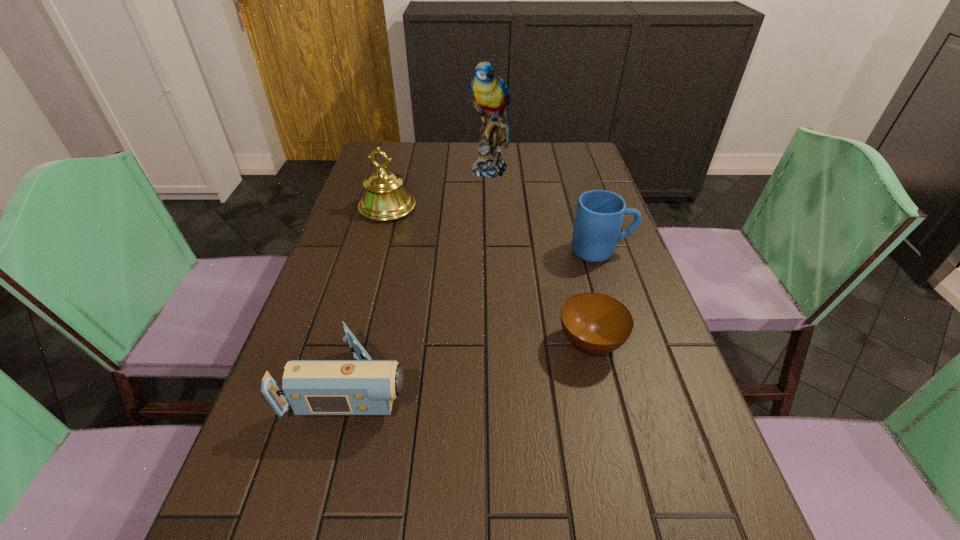
The image size is (960, 540). Find the location of `free space between the shortest object and the camcorder`. free space between the shortest object and the camcorder is located at coordinates (472, 363).

At what (x,y) coordinates should I click in order to perform the action: click on empty space that is in between the mug and the third object from left to right. Please return your answer as a coordinate pair (x, y). Looking at the image, I should click on (545, 210).

Where is `empty space between the fourth shortest object and the shortest object`? empty space between the fourth shortest object and the shortest object is located at coordinates (489, 275).

What are the coordinates of `free space between the bell and the camcorder` in the screenshot? It's located at (371, 295).

Find the location of `vacant space that's between the second tallest object and the fourth tallest object`. vacant space that's between the second tallest object and the fourth tallest object is located at coordinates (371, 295).

Identify which object is the nearest to the bowl. Please provide its 2D coordinates. Your answer should be formatted as a tuple, i.e. [(x, y)], where the tuple contains the x and y coordinates of a point satisfying the conditions above.

[(599, 216)]

Find the location of `object that stands as the third closest to the bell`. object that stands as the third closest to the bell is located at coordinates (364, 387).

At what (x,y) coordinates should I click in order to perform the action: click on vacant space that satisfies the following two spatial constraints: 1. on the face of the third object from right to left; 2. on the side of the fourth tallest object with the flip-out screen. Please return your answer as a coordinate pair (x, y). Looking at the image, I should click on (496, 383).

At what (x,y) coordinates should I click in order to perform the action: click on blank area in the image that satisfies the following two spatial constraints: 1. on the face of the shortest object; 2. on the left side of the farthest object. Please return your answer as a coordinate pair (x, y). The height and width of the screenshot is (540, 960). Looking at the image, I should click on (495, 343).

The width and height of the screenshot is (960, 540). In order to click on free space that satisfies the following two spatial constraints: 1. on the face of the third object from left to right; 2. on the side of the second shortest object with the flip-out screen in this screenshot , I will do `click(496, 383)`.